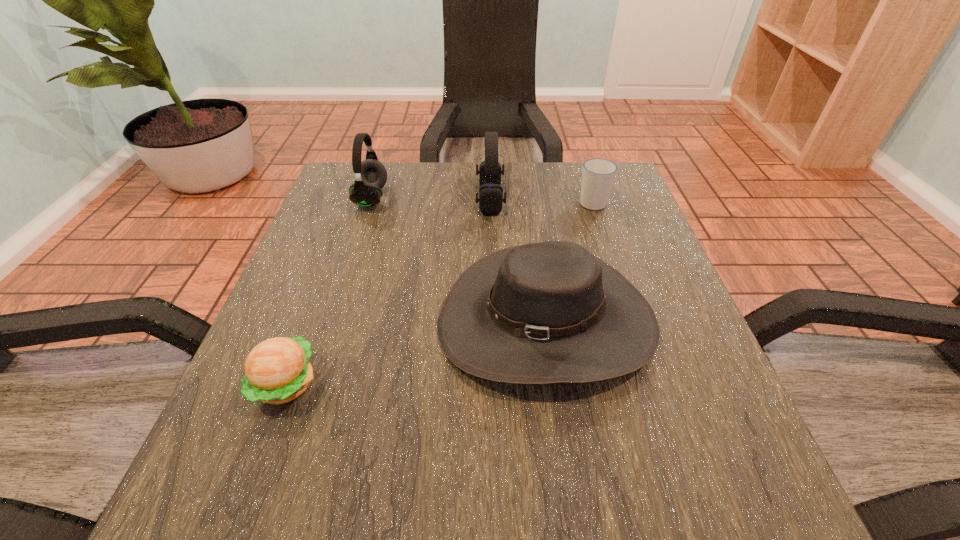
At what (x,y) coordinates should I click in order to perform the action: click on unoccupied area between the cup and the shortest object. Please return your answer as a coordinate pair (x, y). Looking at the image, I should click on (439, 293).

The height and width of the screenshot is (540, 960). What are the coordinates of `free space between the right headset and the left headset` in the screenshot? It's located at (431, 199).

In order to click on free area in between the left headset and the right headset in this screenshot , I will do `click(431, 199)`.

Find the location of a particular element. vacant point located between the cowboy hat and the shortest object is located at coordinates (416, 353).

The width and height of the screenshot is (960, 540). I want to click on free space that is in between the left headset and the cowboy hat, so click(459, 260).

Locate an element on the screen. The height and width of the screenshot is (540, 960). free space between the cup and the hamburger is located at coordinates (439, 293).

Select which object appears as the second closest to the right headset. Please provide its 2D coordinates. Your answer should be formatted as a tuple, i.e. [(x, y)], where the tuple contains the x and y coordinates of a point satisfying the conditions above.

[(598, 175)]

Locate which object ranks in proximity to the right headset. Please provide its 2D coordinates. Your answer should be formatted as a tuple, i.e. [(x, y)], where the tuple contains the x and y coordinates of a point satisfying the conditions above.

[(551, 312)]

The image size is (960, 540). In order to click on vacant point that satisfies the following two spatial constraints: 1. on the ear cups of the left headset; 2. with a handle on the side of the cup in this screenshot , I will do `click(371, 202)`.

Locate an element on the screen. This screenshot has height=540, width=960. vacant position in the image that satisfies the following two spatial constraints: 1. with a handle on the side of the cup; 2. on the headband of the right headset is located at coordinates (591, 199).